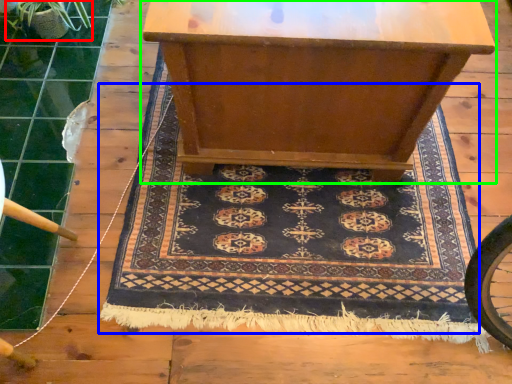
Question: Which object is positioned farthest from plant (highlighted by a red box)? Select from mat (highlighted by a blue box) and table (highlighted by a green box).

Choices:
 (A) mat
 (B) table

Answer: (A)